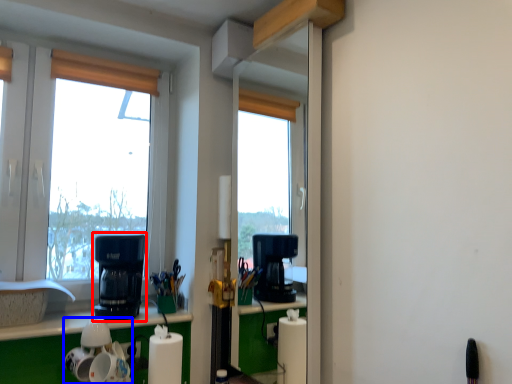
Question: Which of the following is the farthest to the observer, kitchen appliance (highlighted by a red box) or appliance (highlighted by a blue box)?

Choices:
 (A) kitchen appliance
 (B) appliance

Answer: (A)